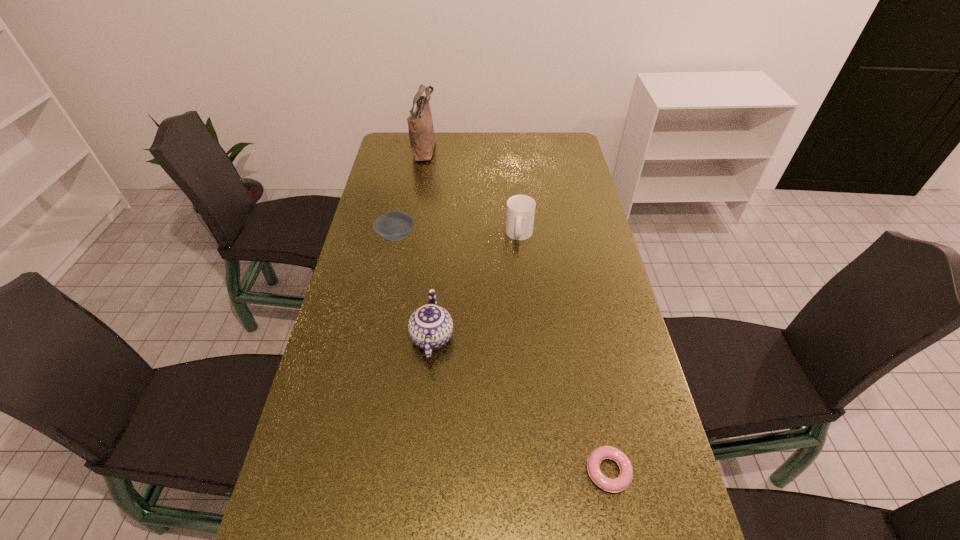
Where is `shoulder bag`? The width and height of the screenshot is (960, 540). shoulder bag is located at coordinates (420, 124).

Identify the location of the tallest object. click(420, 124).

Identify the location of the fourth object from left to right. The image size is (960, 540). (520, 213).

This screenshot has height=540, width=960. I want to click on the fourth farthest object, so click(x=430, y=327).

Find the location of a particular element. the second shortest object is located at coordinates (394, 226).

Locate an element on the screen. Image resolution: width=960 pixels, height=540 pixels. the shortest object is located at coordinates (615, 485).

Find the location of `doughnut`. doughnut is located at coordinates (615, 485).

The image size is (960, 540). Identify the location of free space located on the front-facing side of the shoulder bag. (493, 148).

Locate an element on the screen. free space located 0.320m on the handle side of the mug is located at coordinates (528, 323).

The height and width of the screenshot is (540, 960). In order to click on free space located at the spout of the chinaware in this screenshot , I will do `click(442, 237)`.